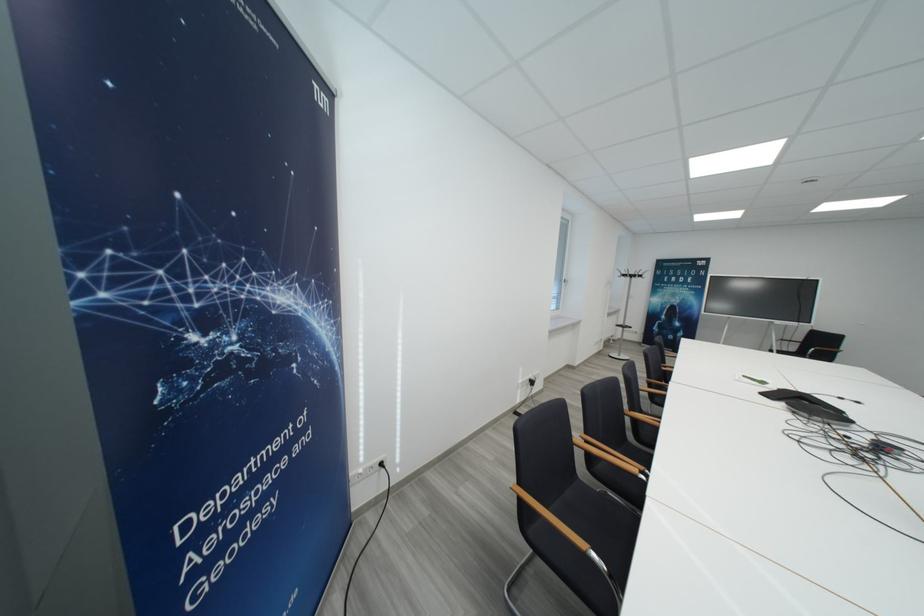
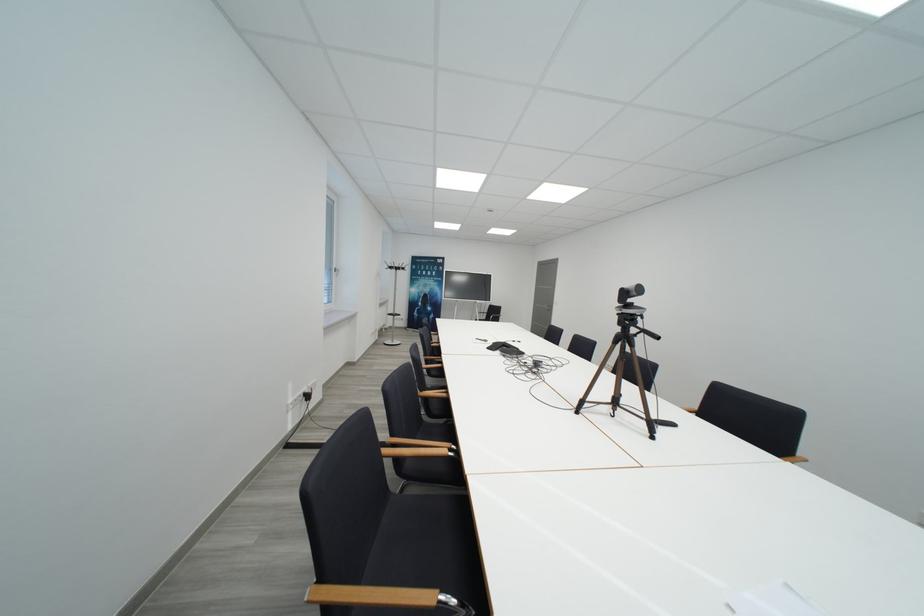
In the second image, find the point that corresponds to (x=617, y=578) in the first image.

(468, 607)